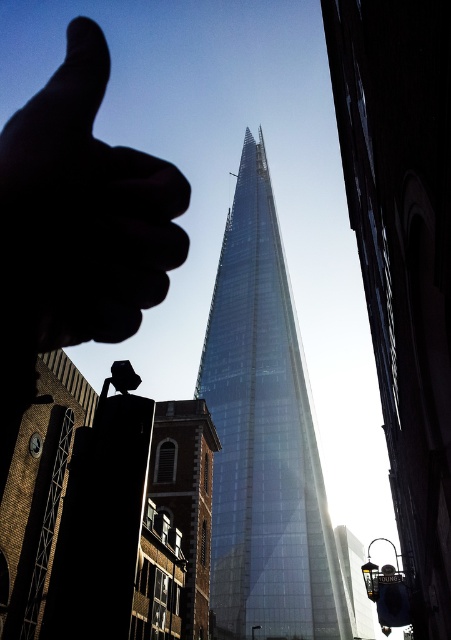
You are a photographer who wants to capture the transparent glass tower at center without the black matte hand at upper left appearing in the shot. Is it possible to adjust your camera angle to exclude the hand while still framing the tower?

The transparent glass tower at center might be wider than black matte hand at upper left, so it depends on the exact dimensions and positioning. If the tower is indeed wider, adjusting the camera angle could allow you to frame the tower while excluding the hand. However, if they are similar in width, the hand might still be partially visible. Check the actual measurements or experiment with different angles to confirm.

You are a photographer trying to capture the transparent glass tower at center without the black matte hand at upper left blocking it. Can you adjust your position to achieve this?

The transparent glass tower at center is above the black matte hand at upper left, so moving the camera upwards slightly should allow you to capture the tower without the hand blocking it.

You are a photographer trying to capture the skyscraper in the center of your photo. You have two points marked in your viewfinder at coordinates point (303, 502) and point (106, 196). Which point should you focus on to ensure the skyscraper is sharp?

You should focus on point (303, 502) because it is closer to the camera than point (106, 196), and the skyscraper is the main subject in the scene.